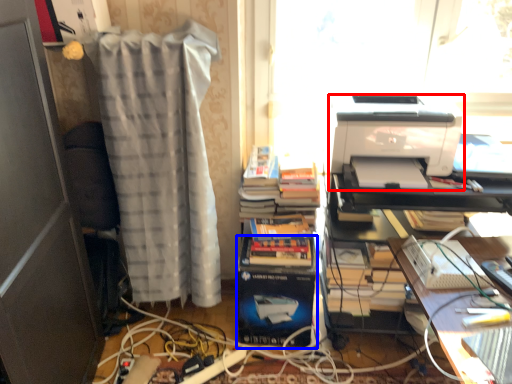
Question: Which of the following is the closest to the observer, printer (highlighted by a red box) or paperback book (highlighted by a blue box)?

Choices:
 (A) printer
 (B) paperback book

Answer: (A)